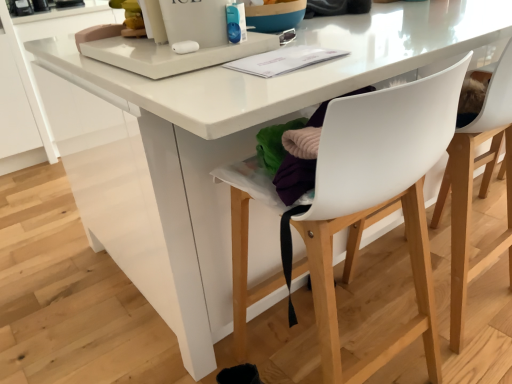
Question: Relative to white plastic chair at center, arranged as the first chair when viewed from the left, is white plastic chair at center, acting as the 2th chair starting from the left, in front or behind?

Choices:
 (A) behind
 (B) front

Answer: (A)

Question: Is point (467, 180) positioned closer to the camera than point (412, 334)?

Choices:
 (A) farther
 (B) closer

Answer: (A)

Question: Considering the relative positions of white plastic chair at center, the first chair from the right, and white plastic chair at center, arranged as the first chair when viewed from the left, in the image provided, is white plastic chair at center, the first chair from the right, to the left or to the right of white plastic chair at center, arranged as the first chair when viewed from the left,?

Choices:
 (A) left
 (B) right

Answer: (B)

Question: From the image's perspective, is white plastic chair at center, the second chair from the right, positioned above or below white plastic chair at center, the first chair from the right?

Choices:
 (A) above
 (B) below

Answer: (B)

Question: From a real-world perspective, is white plastic chair at center, the second chair from the right, positioned above or below white plastic chair at center, acting as the 2th chair starting from the left?

Choices:
 (A) above
 (B) below

Answer: (A)

Question: Is white plastic chair at center, the second chair from the right, bigger or smaller than white plastic chair at center, acting as the 2th chair starting from the left?

Choices:
 (A) big
 (B) small

Answer: (A)

Question: Looking at their shapes, would you say white plastic chair at center, arranged as the first chair when viewed from the left, is wider or thinner than white plastic chair at center, the first chair from the right?

Choices:
 (A) wide
 (B) thin

Answer: (A)